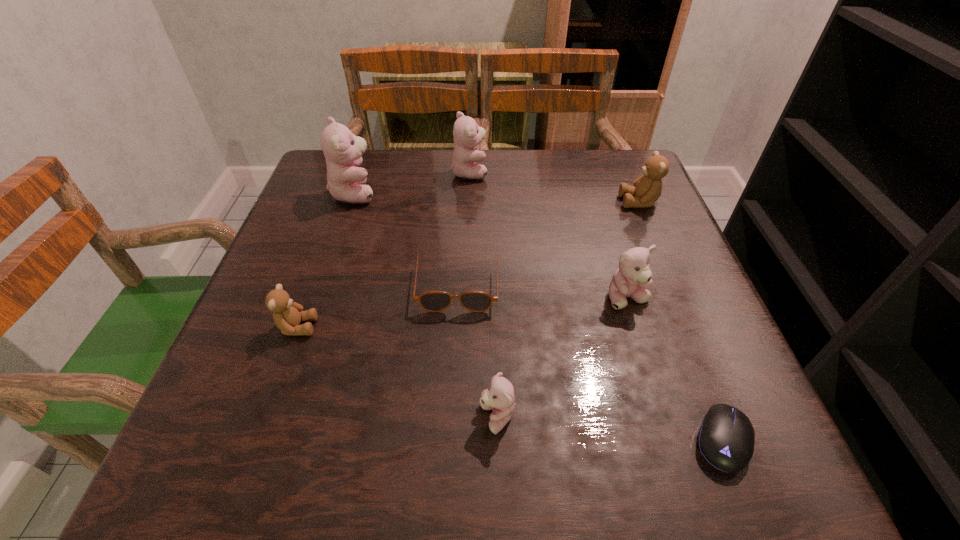
Where is `the biggest pink teddy bear`? This screenshot has height=540, width=960. the biggest pink teddy bear is located at coordinates (343, 151).

Image resolution: width=960 pixels, height=540 pixels. Find the location of `the leftmost pink teddy bear`. the leftmost pink teddy bear is located at coordinates (343, 151).

Where is `the second biggest pink teddy bear`? the second biggest pink teddy bear is located at coordinates (467, 134).

You are a GUI agent. You are given a task and a screenshot of the screen. Output one action in this format:
    pyautogui.click(x=<x>, y=<y>)
    Task: Click on the seventh shortest object
    The width and height of the screenshot is (960, 540).
    Given the screenshot: What is the action you would take?
    pyautogui.click(x=467, y=134)

I want to click on the rightmost teddy bear, so click(x=646, y=190).

Where is `the farther brown teddy bear`? Image resolution: width=960 pixels, height=540 pixels. the farther brown teddy bear is located at coordinates (646, 190).

Where is `the second nearest pink teddy bear`? This screenshot has height=540, width=960. the second nearest pink teddy bear is located at coordinates (633, 278).

Locate an element on the screen. Image resolution: width=960 pixels, height=540 pixels. the fifth teddy bear from left to right is located at coordinates (633, 278).

The width and height of the screenshot is (960, 540). Identify the location of the smaller brown teddy bear. (287, 314).

Image resolution: width=960 pixels, height=540 pixels. Identify the location of the nearer brown teddy bear. (287, 314).